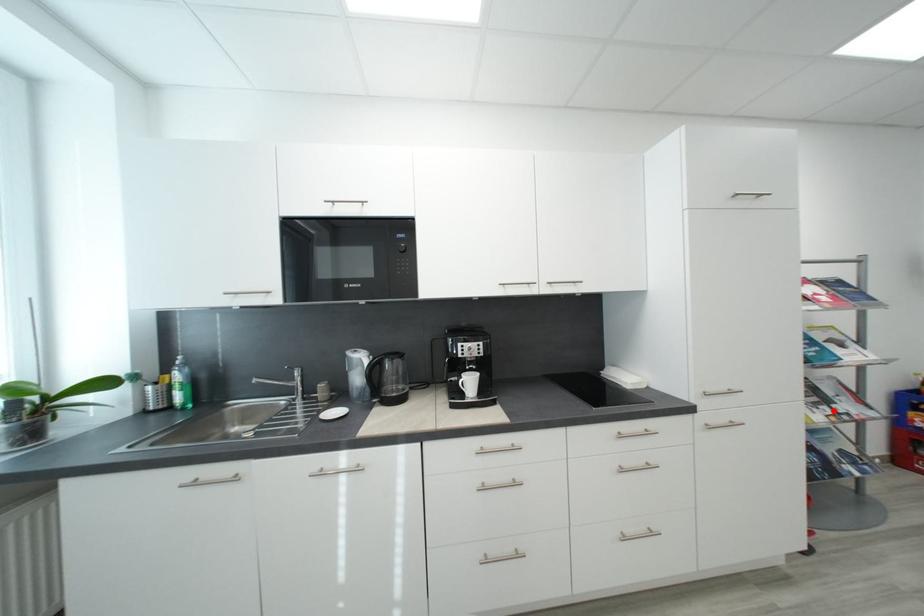
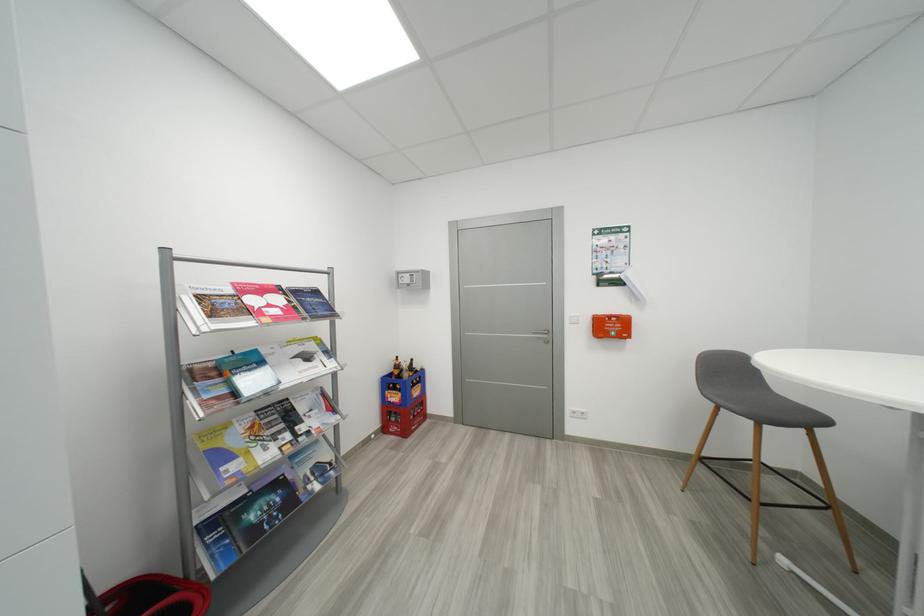
Question: I am providing you with two images of the same scene from different viewpoints. Image1 has a red point marked. In image2, the corresponding 3D location appears at what relative position? Reply with the corresponding letter.

Choices:
 (A) Closer
 (B) Farther

Answer: (B)